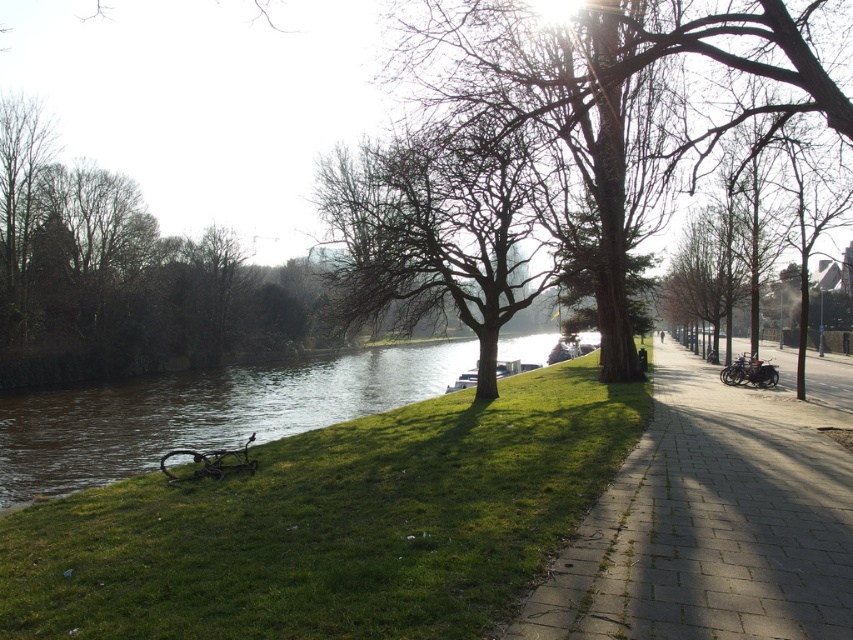
Question: Which point is farther from the camera taking this photo?

Choices:
 (A) (509, 280)
 (B) (238, 292)

Answer: (B)

Question: Does green grass at lower left appear under paved stone sidewalk at center?

Choices:
 (A) no
 (B) yes

Answer: (B)

Question: Considering the real-world distances, which object is closest to the smooth bark tree at center?

Choices:
 (A) bare wood tree at center
 (B) paved stone sidewalk at center

Answer: (A)

Question: Is the position of green grass at lower left less distant than that of brown leafless tree at left?

Choices:
 (A) yes
 (B) no

Answer: (A)

Question: Which point is farther to the camera?

Choices:
 (A) (752, 592)
 (B) (149, 262)
 (C) (74, 572)

Answer: (B)

Question: Does paved stone sidewalk at center lie behind bare wood tree at center?

Choices:
 (A) no
 (B) yes

Answer: (A)